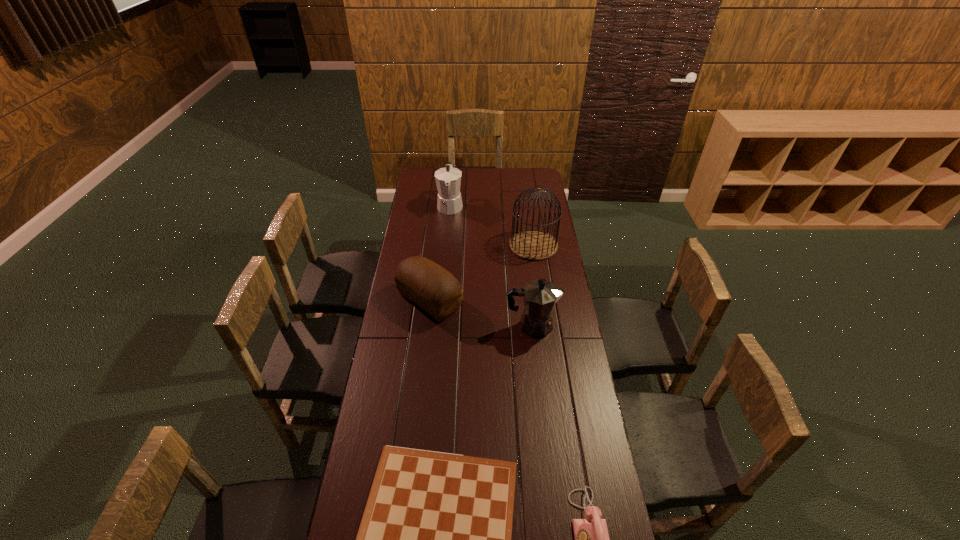
This screenshot has height=540, width=960. In order to click on the tallest object in this screenshot , I will do `click(531, 244)`.

I want to click on birdcage, so click(x=531, y=244).

I want to click on the farthest object, so click(x=448, y=180).

I want to click on the left coffeepot, so [x=448, y=180].

Find the location of `the right coffeepot`. the right coffeepot is located at coordinates (539, 296).

I want to click on the fourth tallest object, so click(420, 280).

Image resolution: width=960 pixels, height=540 pixels. What are the coordinates of `free spot located 0.310m at the door of the fifth nearest object` in the screenshot? It's located at (449, 245).

Find the location of a particular element. The height and width of the screenshot is (540, 960). vacant region located 0.270m at the door of the fifth nearest object is located at coordinates (457, 245).

At what (x,y) coordinates should I click in order to perform the action: click on vacant space located 0.400m at the door of the fifth nearest object. Please return your answer as a coordinate pair (x, y). The height and width of the screenshot is (540, 960). Looking at the image, I should click on (432, 245).

Locate an element on the screen. vacant space located at the spout of the farthest object is located at coordinates (x=446, y=254).